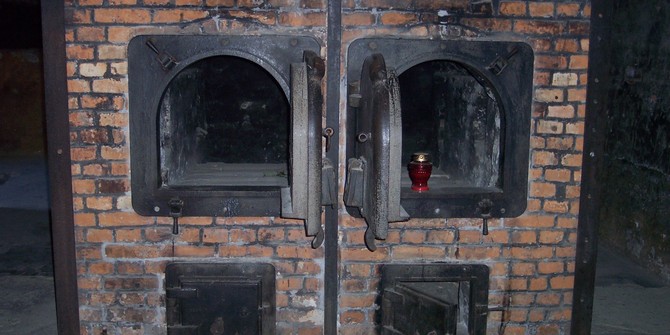
Identify the location of oven. (232, 121), (448, 126).